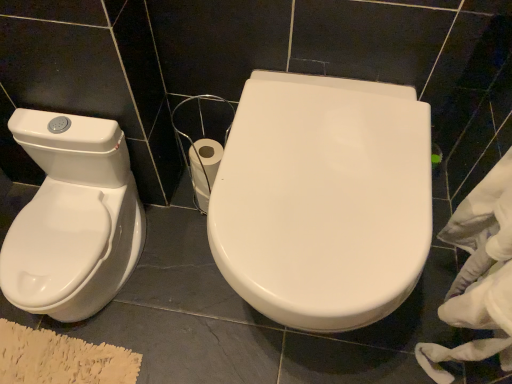
Identify the location of free spot to the right of white glossy bidet at left. This screenshot has height=384, width=512. (170, 284).